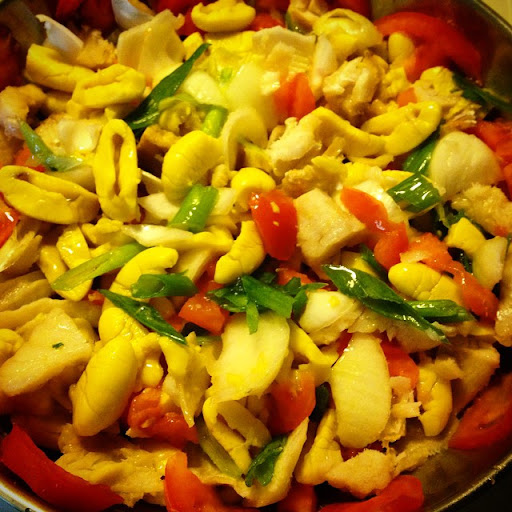
Identify the location of inside of bowl. Image resolution: width=512 pixels, height=512 pixels. (447, 465), (485, 46), (28, 482).